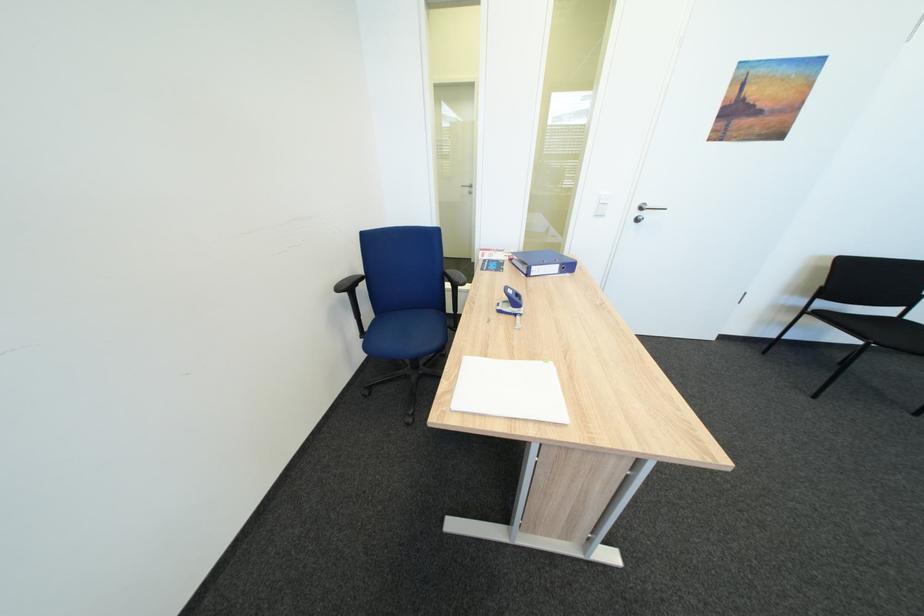
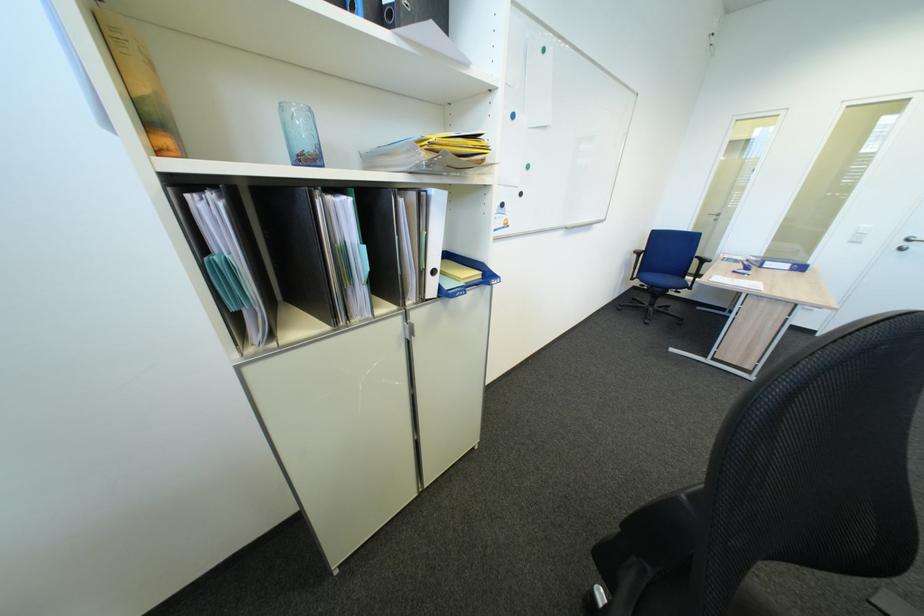
Locate, in the second image, the point that corresponds to (x=511, y=313) in the first image.

(745, 274)